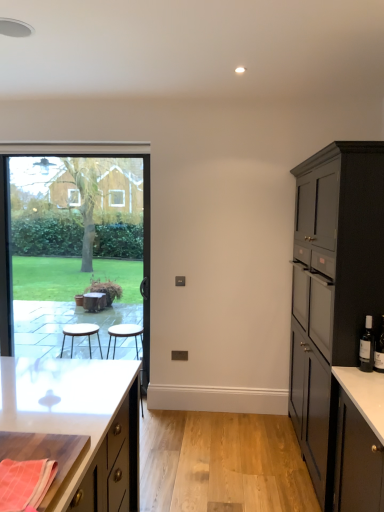
In order to face transparent glass window at left, should I rotate leftwards or rightwards?

A 15.460 degree turn to the left will do.

The image size is (384, 512). What do you see at coordinates (71, 405) in the screenshot? I see `wooden cutting board at lower left, the second cabinetry from the right` at bounding box center [71, 405].

The height and width of the screenshot is (512, 384). I want to click on dark glass wine bottle at right, so click(x=379, y=349).

The height and width of the screenshot is (512, 384). I want to click on matte black cabinet at right, positioned as the second cabinetry in left-to-right order, so click(x=332, y=289).

In order to face black glass bottle at right, should I rotate leftwards or rightwards?

Rotate right and turn 22.055 degrees.

In order to click on transparent glass window at left in this screenshot , I will do `click(74, 251)`.

Can you confirm if black glass bottle at right is positioned to the left of dark glass wine bottle at right?

Correct, you'll find black glass bottle at right to the left of dark glass wine bottle at right.

Can you confirm if black glass bottle at right is thinner than dark glass wine bottle at right?

No.

Considering the sizes of objects black glass bottle at right and dark glass wine bottle at right in the image provided, who is taller, black glass bottle at right or dark glass wine bottle at right?

With more height is dark glass wine bottle at right.

Is black glass bottle at right beside dark glass wine bottle at right?

Yes.

From the image's perspective, does transparent glass window at left appear higher than orange woven cloth at lower left?

Indeed, from the image's perspective, transparent glass window at left is shown above orange woven cloth at lower left.

Which is more to the right, transparent glass window at left or orange woven cloth at lower left?

orange woven cloth at lower left is more to the right.

Can you tell me how much transparent glass window at left and orange woven cloth at lower left differ in facing direction?

There is a 87.1-degree angle between the facing directions of transparent glass window at left and orange woven cloth at lower left.

Is transparent glass window at left next to orange woven cloth at lower left?

They are not placed beside each other.

Based on the photo, from their relative heights in the image, would you say orange woven cloth at lower left is taller or shorter than matte black cabinet at right, positioned as the second cabinetry in left-to-right order?

In the image, orange woven cloth at lower left appears to be shorter than matte black cabinet at right, positioned as the second cabinetry in left-to-right order.

Is orange woven cloth at lower left in contact with matte black cabinet at right, marked as the 1th cabinetry in a right-to-left arrangement?

No.

From the image's perspective, which object appears higher, orange woven cloth at lower left or matte black cabinet at right, positioned as the second cabinetry in left-to-right order?

From the image's view, matte black cabinet at right, positioned as the second cabinetry in left-to-right order, is above.

Is orange woven cloth at lower left positioned with its back to matte black cabinet at right, positioned as the second cabinetry in left-to-right order?

No.

Considering the relative sizes of transparent glass window at left and black glass bottle at right in the image provided, is transparent glass window at left thinner than black glass bottle at right?

No.

Which object is closer to the camera taking this photo, transparent glass window at left or black glass bottle at right?

black glass bottle at right is closer to the camera.

Is transparent glass window at left not inside black glass bottle at right?

That's correct, transparent glass window at left is outside of black glass bottle at right.

Can you confirm if dark glass wine bottle at right is thinner than black glass bottle at right?

Yes.

Do you think dark glass wine bottle at right is within black glass bottle at right, or outside of it?

dark glass wine bottle at right is located beyond the bounds of black glass bottle at right.

Is dark glass wine bottle at right to the left of black glass bottle at right from the viewer's perspective?

Incorrect, dark glass wine bottle at right is not on the left side of black glass bottle at right.

Is dark glass wine bottle at right behind black glass bottle at right?

No, dark glass wine bottle at right is in front of black glass bottle at right.

From the image's perspective, which object appears higher, black glass bottle at right or wooden stool at center?

black glass bottle at right.

Find the location of `bottle lying on the right of wooden stool at center`. bottle lying on the right of wooden stool at center is located at coordinates [367, 346].

Relative to wooden stool at center, is black glass bottle at right in front or behind?

Visually, black glass bottle at right is located in front of wooden stool at center.

How different are the orientations of black glass bottle at right and wooden stool at center in degrees?

They differ by 24.8 degrees in their facing directions.

Is point (63, 340) positioned after point (9, 481)?

Yes, point (63, 340) is farther from viewer.

From a real-world perspective, between wooden stool at center and orange woven cloth at lower left, who is vertically higher?

orange woven cloth at lower left, from a real-world perspective.

Is wooden stool at center directly adjacent to orange woven cloth at lower left?

wooden stool at center and orange woven cloth at lower left are not in contact.

Is wooden stool at center surrounding orange woven cloth at lower left?

Definitely not — orange woven cloth at lower left is not inside wooden stool at center.

This screenshot has width=384, height=512. I want to click on bottle behind the dark glass wine bottle at right, so [x=367, y=346].

Locate an element on the screen. The width and height of the screenshot is (384, 512). material lying below the transparent glass window at left (from the image's perspective) is located at coordinates (25, 483).

Considering their positions, is dark glass wine bottle at right positioned closer to wooden stool at center than transparent glass window at left?

The object closer to wooden stool at center is transparent glass window at left.

Estimate the real-world distances between objects in this image. Which object is closer to transparent glass window at left, dark glass wine bottle at right or black glass bottle at right?

Based on the image, black glass bottle at right appears to be nearer to transparent glass window at left.

Considering their positions, is black glass bottle at right positioned further to dark glass wine bottle at right than matte black cabinet at right, positioned as the second cabinetry in left-to-right order?

matte black cabinet at right, positioned as the second cabinetry in left-to-right order.

Looking at the image, which one is located further to dark glass wine bottle at right, wooden cutting board at lower left, the second cabinetry from the right, or black glass bottle at right?

wooden cutting board at lower left, the second cabinetry from the right, lies further to dark glass wine bottle at right than the other object.

When comparing their distances from dark glass wine bottle at right, does orange woven cloth at lower left or wooden stool at center seem closer?

Among the two, orange woven cloth at lower left is located nearer to dark glass wine bottle at right.

Estimate the real-world distances between objects in this image. Which object is further from wooden stool at center, orange woven cloth at lower left or black glass bottle at right?

The object further to wooden stool at center is orange woven cloth at lower left.

Looking at the image, which one is located closer to wooden stool at center, dark glass wine bottle at right or black glass bottle at right?

The object closer to wooden stool at center is black glass bottle at right.

When comparing their distances from orange woven cloth at lower left, does dark glass wine bottle at right or black glass bottle at right seem closer?

dark glass wine bottle at right is closer to orange woven cloth at lower left.

Identify the location of wine bottle between orange woven cloth at lower left and wooden stool at center in the front-back direction. (379, 349).

The height and width of the screenshot is (512, 384). Identify the location of bottle between orange woven cloth at lower left and wooden stool at center in the front-back direction. (367, 346).

Locate an element on the screen. The width and height of the screenshot is (384, 512). material located between wooden cutting board at lower left, the second cabinetry from the right, and dark glass wine bottle at right in the left-right direction is located at coordinates (25, 483).

At what (x,y) coordinates should I click in order to perform the action: click on wine bottle between orange woven cloth at lower left and transparent glass window at left in the front-back direction. Please return your answer as a coordinate pair (x, y). The height and width of the screenshot is (512, 384). Looking at the image, I should click on (379, 349).